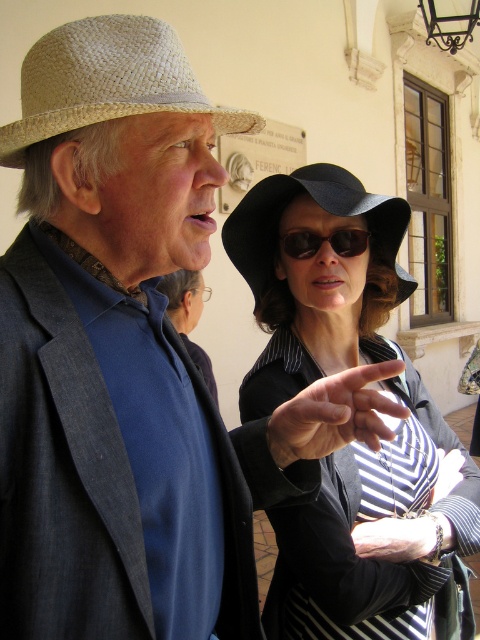
You are standing in front of the scene described. The black felt hat at center is located at coordinates 0.689, 0.740. If you were to walk directly towards the hat, which direction should you move relative to the beige wall with the plaque?

The black felt hat at center is positioned at coordinates [355,440]. Since the beige wall with the plaque is in the background, moving towards the hat would require walking towards the center of the scene where the hat is located, which is between the man and the woman in the image.

You are standing in front of the scene described. There is a natural straw hat at upper left in the image. Can you tell me its exact location in terms of coordinates?

The natural straw hat at upper left is located at coordinates point (108, 81).

In the scene shown: You are a tailor measuring hats for a costume party. You need to place both the black felt hat at center and the matte straw hat at center on a display stand that is 8 inches wide. Will both hats fit side by side on the stand?

The black felt hat at center is 8.13 inches from the matte straw hat at center, which means the total space needed between them is 8.13 inches. Since the display stand is only 8 inches wide, the hats cannot fit side by side without overlapping.